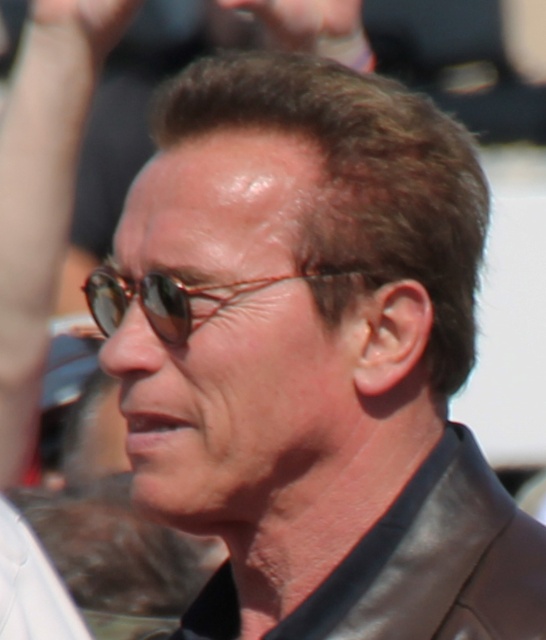
You are a photographer trying to capture a candid shot of the person in the image. You notice the leather jacket at center and the sunglasses at center. Based on their positions, which object is closer to the camera?

The sunglasses at center are closer to the camera because the leather jacket at center is positioned below them, indicating it is further away.

You are taking a photo of a person in a crowd. The camera is positioned at a certain distance from the point where the person is standing. If the point where the person is standing is at coordinates point (400, 584), and the camera is 8.14 feet away from this point, can you estimate how far the camera is from the person?

The camera is 8.14 feet away from the point (400, 584) where the person is standing, so the camera is 8.14 feet away from the person.

You are a photographer adjusting your camera settings to capture the person in the scene. You notice the leather jacket at center and the sunglasses at center. Which object is positioned to the right of the other?

The leather jacket at center is to the right of the sunglasses at center, so the leather jacket at center is positioned to the right of the sunglasses at center.